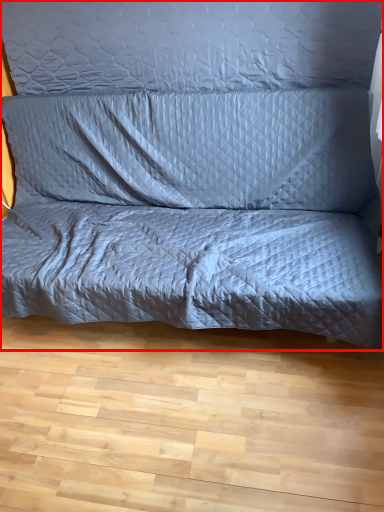
Question: From the image's perspective, where is studio couch (annotated by the red box) located relative to pillow?

Choices:
 (A) below
 (B) above

Answer: (A)